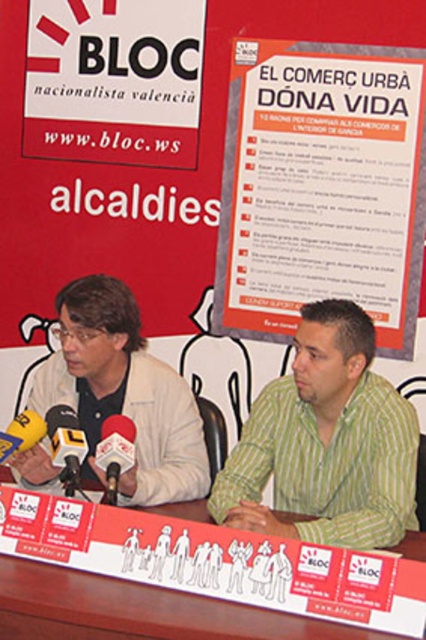
Does wooden table at lower center have a greater width compared to matte white microphone at center?

Correct, the width of wooden table at lower center exceeds that of matte white microphone at center.

Does point (382, 552) come closer to viewer compared to point (118, 413)?

Yes, it is in front of point (118, 413).

Is point (279, 602) farther from camera compared to point (106, 451)?

No.

This screenshot has height=640, width=426. I want to click on wooden table at lower center, so click(x=216, y=561).

Is point (316, 284) in front of point (166, 452)?

No.

Image resolution: width=426 pixels, height=640 pixels. Describe the element at coordinates (322, 188) in the screenshot. I see `red paper poster at upper right` at that location.

Is point (351, 195) positioned in front of point (149, 499)?

That is False.

Identify the location of red paper poster at upper right. This screenshot has width=426, height=640. (322, 188).

Can you confirm if green striped shirt at center is smaller than matte beige jacket at left?

Indeed, green striped shirt at center has a smaller size compared to matte beige jacket at left.

Does green striped shirt at center have a larger size compared to matte beige jacket at left?

Actually, green striped shirt at center might be smaller than matte beige jacket at left.

You are a GUI agent. You are given a task and a screenshot of the screen. Output one action in this format:
    pyautogui.click(x=<x>, y=<y>)
    Task: Click on the green striped shirt at center
    The width and height of the screenshot is (426, 640).
    Given the screenshot: What is the action you would take?
    pyautogui.click(x=325, y=442)